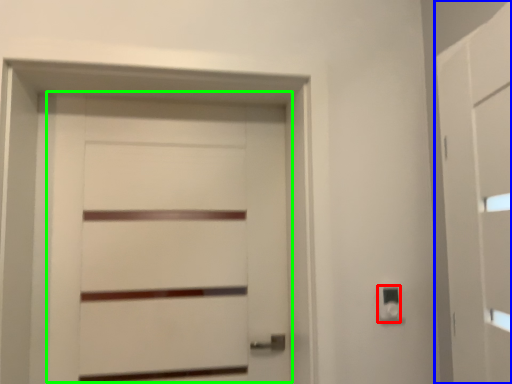
Question: Which is farther away from light switch (highlighted by a red box)? barn door (highlighted by a blue box) or door (highlighted by a green box)?

Choices:
 (A) barn door
 (B) door

Answer: (B)